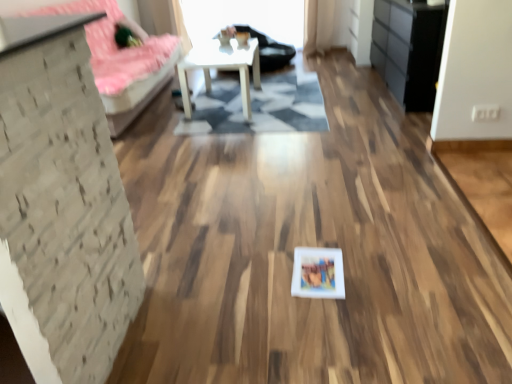
Where is `free location to the right of white matte table at center`? The height and width of the screenshot is (384, 512). free location to the right of white matte table at center is located at coordinates (293, 100).